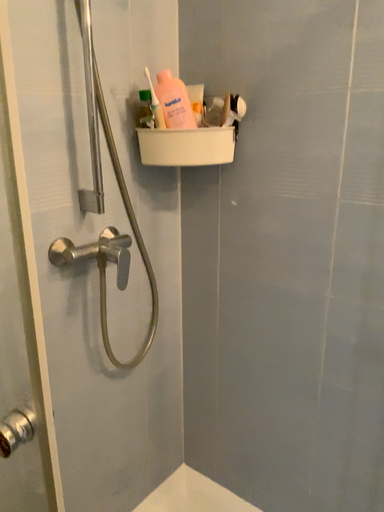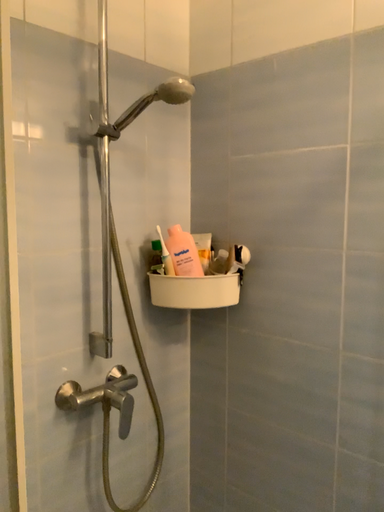
Question: Which way did the camera rotate in the video?

Choices:
 (A) rotated upward
 (B) rotated downward

Answer: (A)